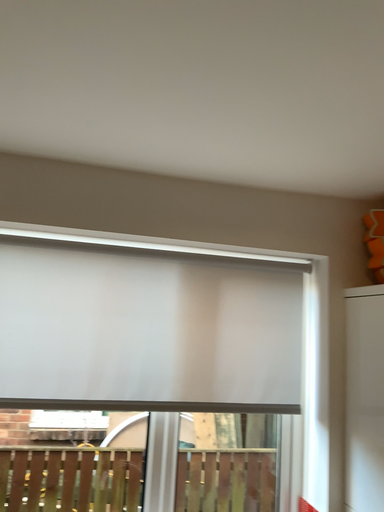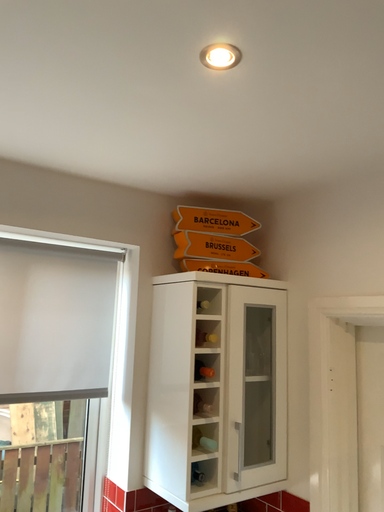
Question: How did the camera likely rotate when shooting the video?

Choices:
 (A) rotated right
 (B) rotated left

Answer: (A)